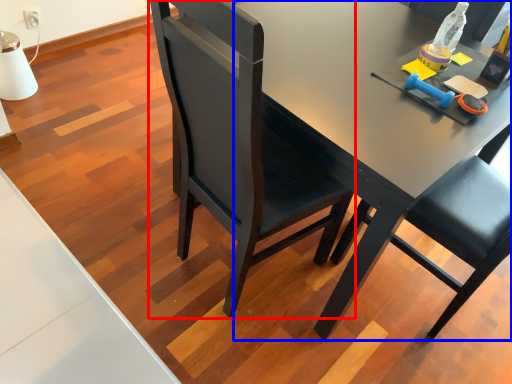
Question: Among these objects, which one is farthest to the camera, chair (highlighted by a red box) or desk (highlighted by a blue box)?

Choices:
 (A) chair
 (B) desk

Answer: (B)